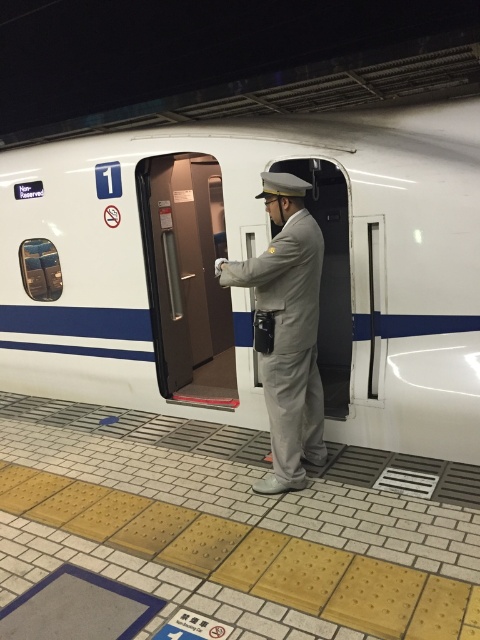
You are standing on the train station platform and want to take a photo of the white glossy train at center with your camera. If you are currently 10.25 feet away from the train, is this distance suitable for capturing the entire train in one frame?

The white glossy train at center and camera are 10.25 feet apart from each other. This distance may not be suitable for capturing the entire train in one frame, as 10.25 feet is relatively close and might require a wide angle lens to fit the entire train in the photo.

You are a passenger holding a large suitcase that is 1.2 meters long. You are standing at the camera position and want to board the train through the brown matte door at center. Can your suitcase fit through the doorway if you carry it horizontally?

The brown matte door at center is 3.84 meters from camera. Since the suitcase is 1.2 meters long, it can easily fit through the doorway when carried horizontally as the distance from the camera to the door is sufficient.